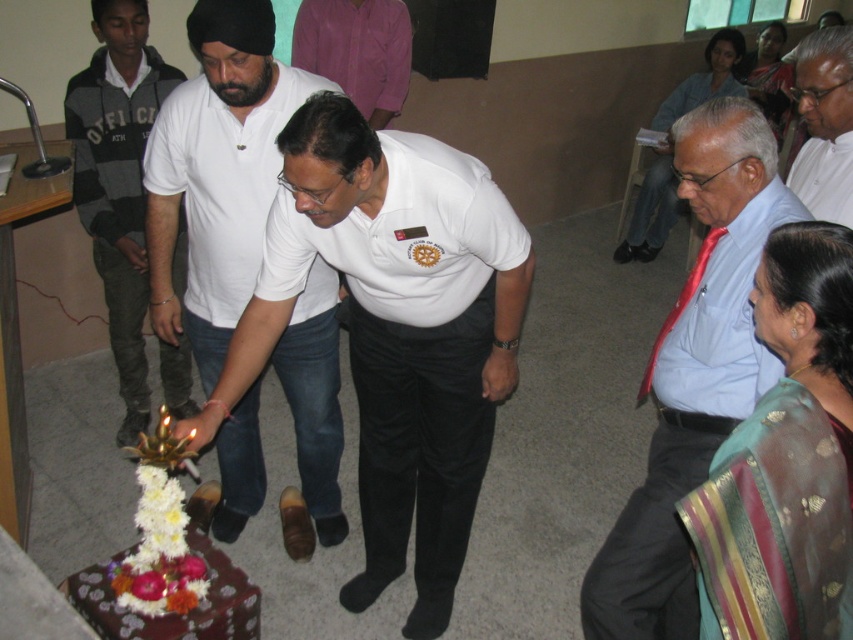
Is point (408, 394) farther from viewer compared to point (624, 520)?

Yes, point (408, 394) is farther from viewer.

Does white matte shirt at center have a greater width compared to light blue shirt at center?

Yes, white matte shirt at center is wider than light blue shirt at center.

Does point (294, 241) come closer to viewer compared to point (720, 314)?

No, (294, 241) is behind (720, 314).

Where is `white matte shirt at center`? white matte shirt at center is located at coordinates (395, 330).

Is matte white shirt at center bigger than pink shirt at upper center?

Correct, matte white shirt at center is larger in size than pink shirt at upper center.

Where is `matte white shirt at center`? The image size is (853, 640). matte white shirt at center is located at coordinates (119, 180).

At what (x,y) coordinates should I click in order to perform the action: click on matte white shirt at center. Please return your answer as a coordinate pair (x, y). Looking at the image, I should click on (119, 180).

Based on the photo, which of these two, white matte shirt at center or white cotton shirt at center, stands shorter?

white matte shirt at center is shorter.

Is white matte shirt at center positioned behind white cotton shirt at center?

No, it is not.

Between point (265, 246) and point (234, 276), which one is positioned behind?

Point (234, 276)

Identify the location of white matte shirt at center. (395, 330).